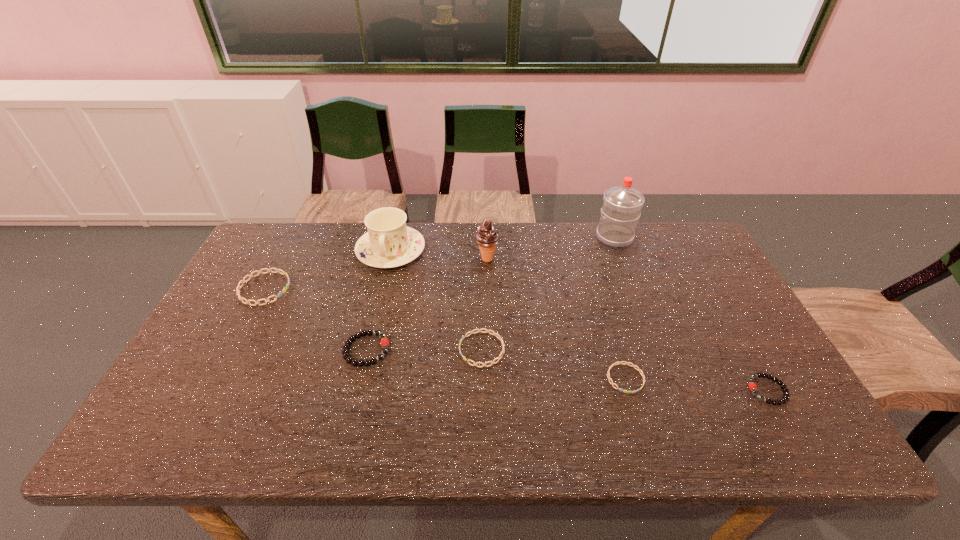
The image size is (960, 540). What are the coordinates of `vacant area at the near edge of the desktop` in the screenshot? It's located at (466, 421).

Find the location of a particular element. This screenshot has height=540, width=960. free space at the left edge is located at coordinates (195, 369).

The height and width of the screenshot is (540, 960). In the image, there is a desktop. Find the location of `vacant space at the right edge`. vacant space at the right edge is located at coordinates (722, 294).

I want to click on vacant space at the near left corner of the desktop, so click(x=188, y=438).

You are a GUI agent. You are given a task and a screenshot of the screen. Output one action in this format:
    pyautogui.click(x=<x>, y=<y>)
    Task: Click on the vacant space at the far right corner
    This screenshot has width=960, height=540.
    Given the screenshot: What is the action you would take?
    pyautogui.click(x=698, y=254)

This screenshot has width=960, height=540. What are the coordinates of `unoccupied area between the second biggest blue bracelet and the shortest object` in the screenshot? It's located at (554, 364).

Image resolution: width=960 pixels, height=540 pixels. Find the location of `empty space between the rightmost blue bracelet and the bigger black bracelet`. empty space between the rightmost blue bracelet and the bigger black bracelet is located at coordinates (496, 364).

The height and width of the screenshot is (540, 960). Identify the location of vacant region between the second blue bracelet from left to right and the chinaware. (437, 300).

At what (x,y) coordinates should I click in order to perform the action: click on empty location between the nearer black bracelet and the bigger black bracelet. Please return your answer as a coordinate pair (x, y). The height and width of the screenshot is (540, 960). Looking at the image, I should click on (566, 370).

Find the location of `free spot between the farther black bracelet and the shortest bracelet`. free spot between the farther black bracelet and the shortest bracelet is located at coordinates (496, 364).